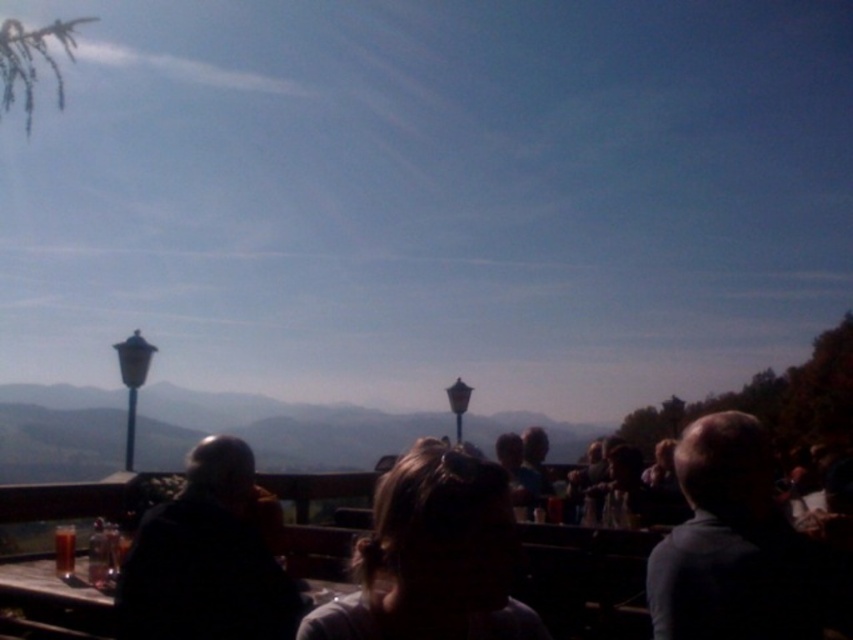
Is dark gray hair at right shorter than dark brown leather jacket at center?

No, dark gray hair at right is not shorter than dark brown leather jacket at center.

Can you confirm if dark gray hair at right is positioned above dark brown leather jacket at center?

Indeed, dark gray hair at right is positioned over dark brown leather jacket at center.

Does point (706, 577) lie behind point (236, 442)?

No.

I want to click on dark gray hair at right, so click(732, 545).

Is point (438, 588) closer to viewer compared to point (653, 616)?

Yes, it is.

What are the coordinates of `light brown hair at center` in the screenshot? It's located at (433, 557).

I want to click on light brown hair at center, so click(433, 557).

What do you see at coordinates (206, 560) in the screenshot? I see `dark brown leather jacket at center` at bounding box center [206, 560].

Between dark brown leather jacket at center and wooden table at lower left, which one appears on the left side from the viewer's perspective?

Positioned to the left is wooden table at lower left.

Find the location of a particular element. Image resolution: width=853 pixels, height=640 pixels. dark brown leather jacket at center is located at coordinates (206, 560).

Where is `dark brown leather jacket at center`? The image size is (853, 640). dark brown leather jacket at center is located at coordinates (206, 560).